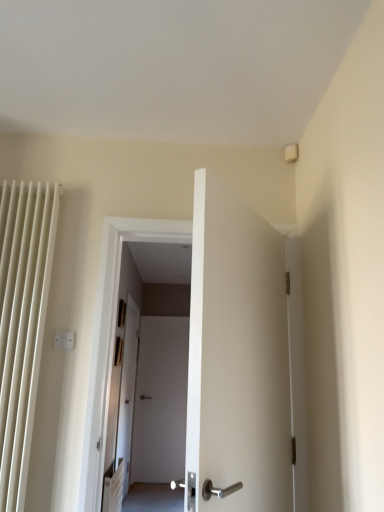
Question: Should I look upward or downward to see satin silver door handle at center?

Choices:
 (A) up
 (B) down

Answer: (B)

Question: Is satin silver door handle at center to the left of white plastic electric outlet at upper center from the viewer's perspective?

Choices:
 (A) yes
 (B) no

Answer: (B)

Question: From the image's perspective, is satin silver door handle at center on white plastic electric outlet at upper center?

Choices:
 (A) no
 (B) yes

Answer: (A)

Question: Is satin silver door handle at center bigger than white plastic electric outlet at upper center?

Choices:
 (A) yes
 (B) no

Answer: (A)

Question: From a real-world perspective, is satin silver door handle at center over white plastic electric outlet at upper center?

Choices:
 (A) yes
 (B) no

Answer: (B)

Question: Would you say satin silver door handle at center is outside white plastic electric outlet at upper center?

Choices:
 (A) yes
 (B) no

Answer: (A)

Question: Does satin silver door handle at center lie in front of white plastic electric outlet at upper center?

Choices:
 (A) yes
 (B) no

Answer: (B)

Question: Is white plastic electric outlet at upper center positioned before satin silver door handle at center?

Choices:
 (A) yes
 (B) no

Answer: (A)

Question: Does white plastic electric outlet at upper center have a greater width compared to satin silver door handle at center?

Choices:
 (A) yes
 (B) no

Answer: (B)

Question: From a real-world perspective, is white plastic electric outlet at upper center positioned under satin silver door handle at center based on gravity?

Choices:
 (A) yes
 (B) no

Answer: (B)

Question: From a real-world perspective, is white plastic electric outlet at upper center located higher than satin silver door handle at center?

Choices:
 (A) yes
 (B) no

Answer: (A)

Question: Can we say white plastic electric outlet at upper center lies outside satin silver door handle at center?

Choices:
 (A) yes
 (B) no

Answer: (A)

Question: Is white plastic electric outlet at upper center taller than satin silver door handle at center?

Choices:
 (A) no
 (B) yes

Answer: (B)

Question: Looking at the image, does satin silver door handle at center seem bigger or smaller compared to white plastic electric outlet at upper center?

Choices:
 (A) big
 (B) small

Answer: (A)